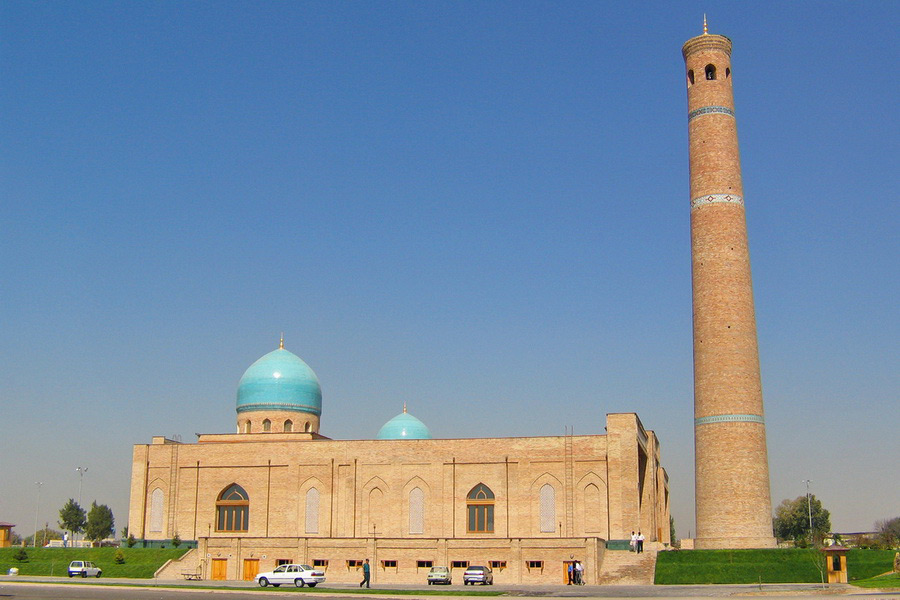
Can you see any where you'd sit and eat in the image? Point to them. Your answer should be formatted as a list of tuples, i.e. [(x1, y1), (x2, y2), ...], where each tuple contains the x and y coordinates of a point satisfying the conditions above.

[(194, 576)]